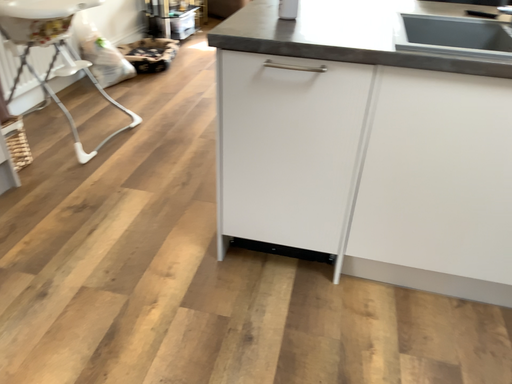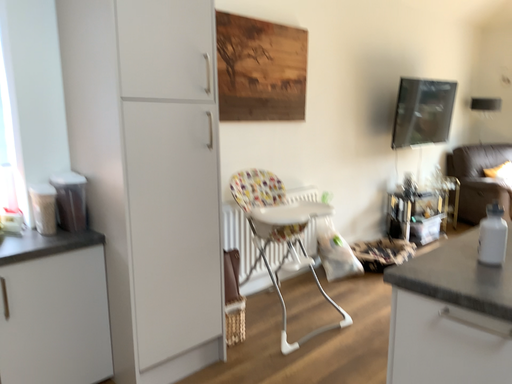
Question: Which way did the camera rotate in the video?

Choices:
 (A) rotated upward
 (B) rotated downward

Answer: (A)